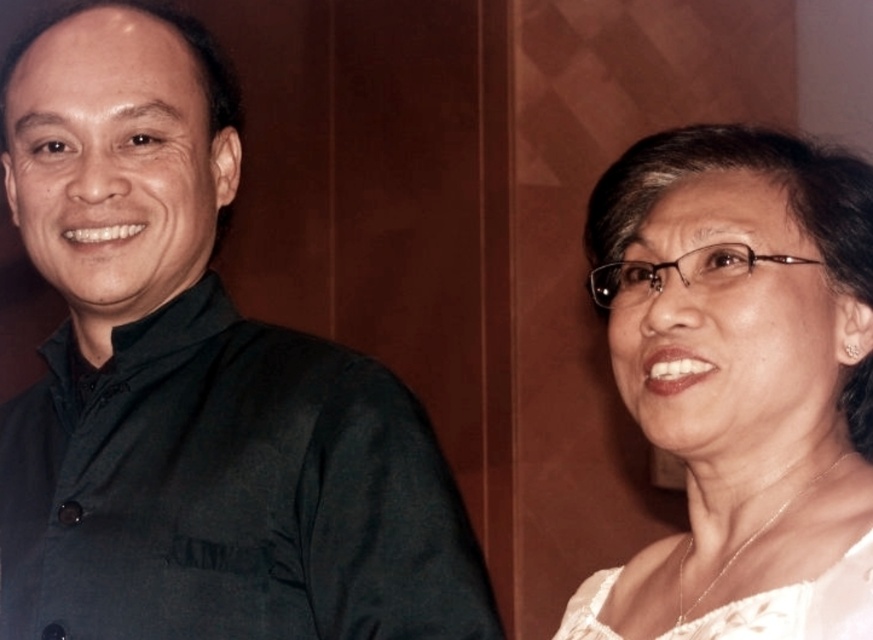
You are a photographer adjusting the camera focus. You need to ensure that both the dark green shirt at left and the white lace blouse at upper right are in focus. Which object should you focus on first to ensure both are sharp?

You should focus on the dark green shirt at left first because the white lace blouse at upper right is behind it, so focusing on the closer object will ensure both are in focus.